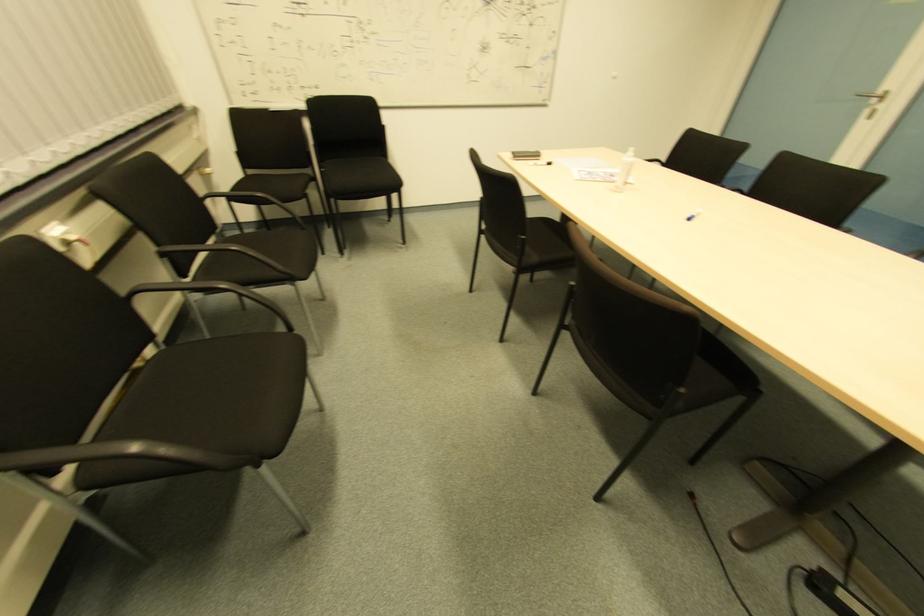
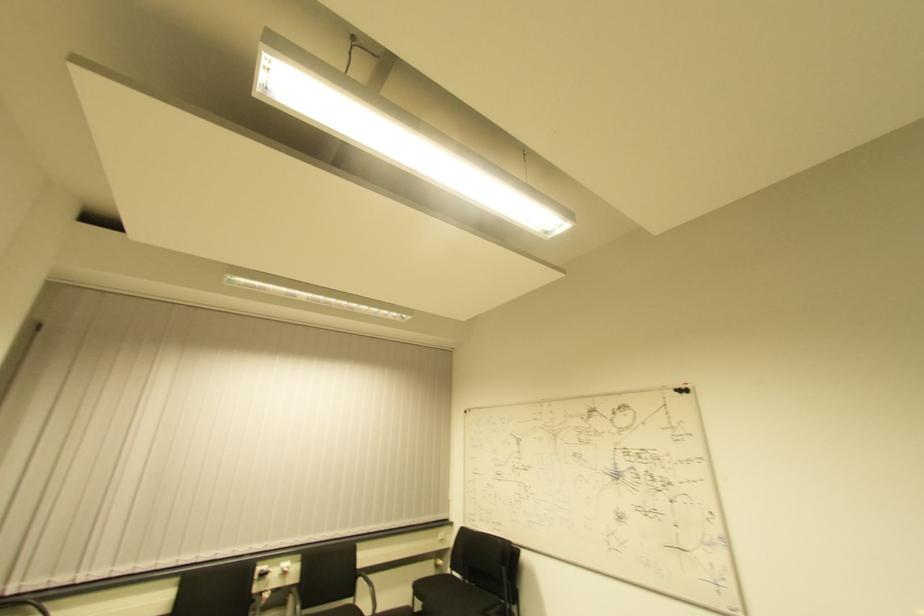
Locate, in the second image, the point that corresponds to (x=249, y=176) in the first image.

(454, 576)